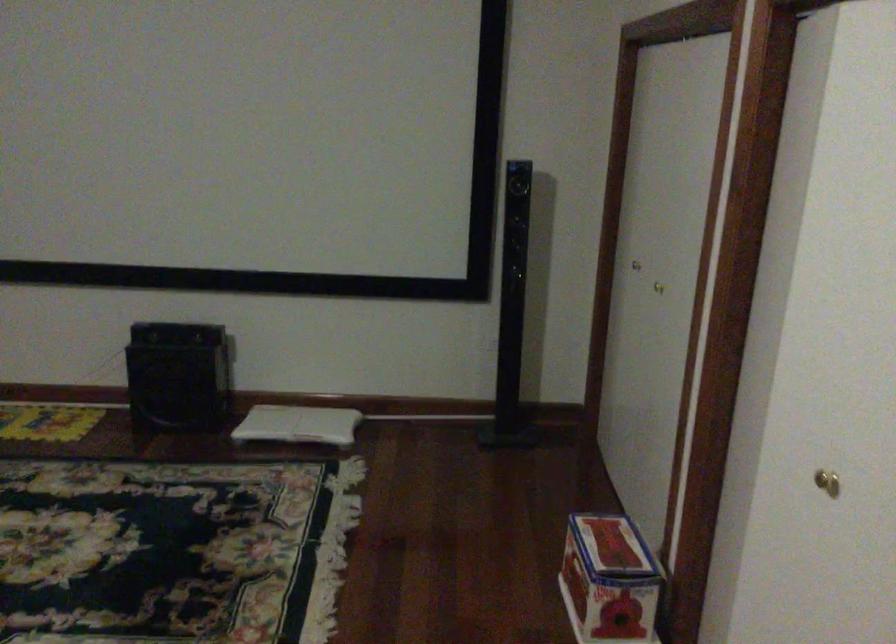
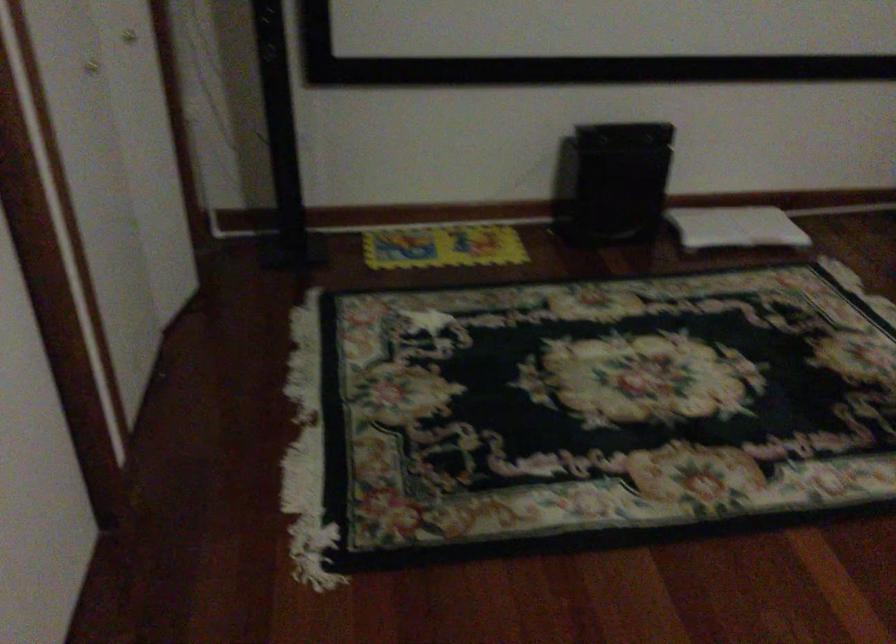
Where in the second image is the point corresponding to the point at 273,428 from the first image?

(735, 227)